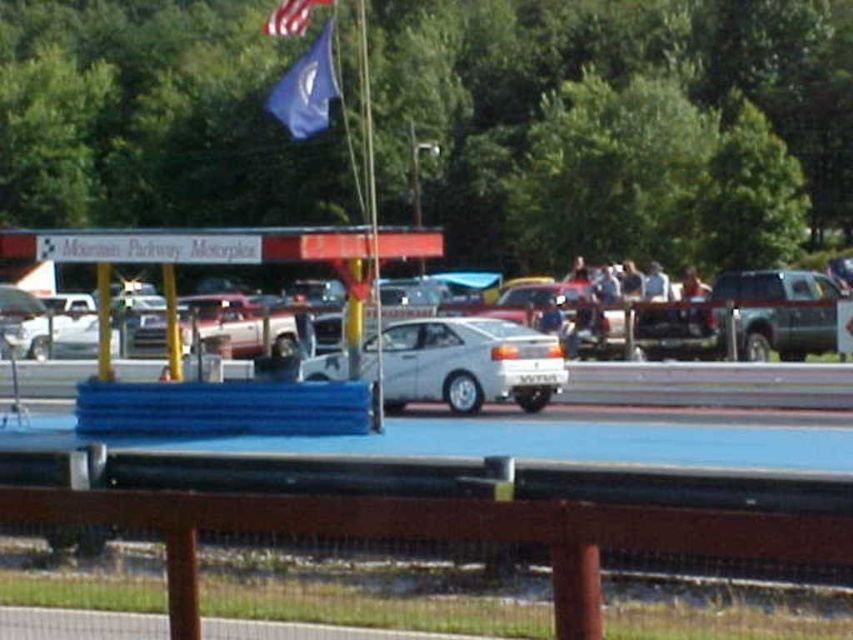
Question: Does white matte sedan at center have a greater width compared to metallic silver suv at right?

Choices:
 (A) no
 (B) yes

Answer: (A)

Question: Does white matte sedan at center appear on the right side of metallic silver suv at right?

Choices:
 (A) yes
 (B) no

Answer: (B)

Question: Among these objects, which one is nearest to the camera?

Choices:
 (A) american flag at upper center
 (B) metallic silver suv at right
 (C) metallic flag pole at center

Answer: (C)

Question: Estimate the real-world distances between objects in this image. Which object is closer to the metallic flag pole at center?

Choices:
 (A) metallic silver suv at right
 (B) white matte sedan at center
 (C) american flag at upper center
 (D) blue fabric flag at upper center

Answer: (B)

Question: Is white matte sedan at center wider than blue fabric flag at upper center?

Choices:
 (A) yes
 (B) no

Answer: (B)

Question: Which object is closer to the camera taking this photo?

Choices:
 (A) metallic flag pole at center
 (B) metallic silver suv at right
 (C) american flag at upper center
 (D) blue fabric flag at upper center

Answer: (A)